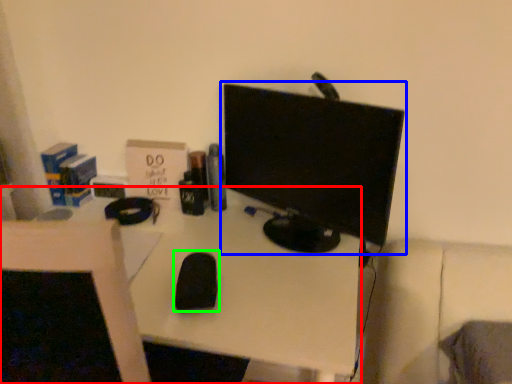
Question: Based on their relative distances, which object is farther from desk (highlighted by a red box)? Choose from computer monitor (highlighted by a blue box) and mouse (highlighted by a green box).

Choices:
 (A) computer monitor
 (B) mouse

Answer: (A)